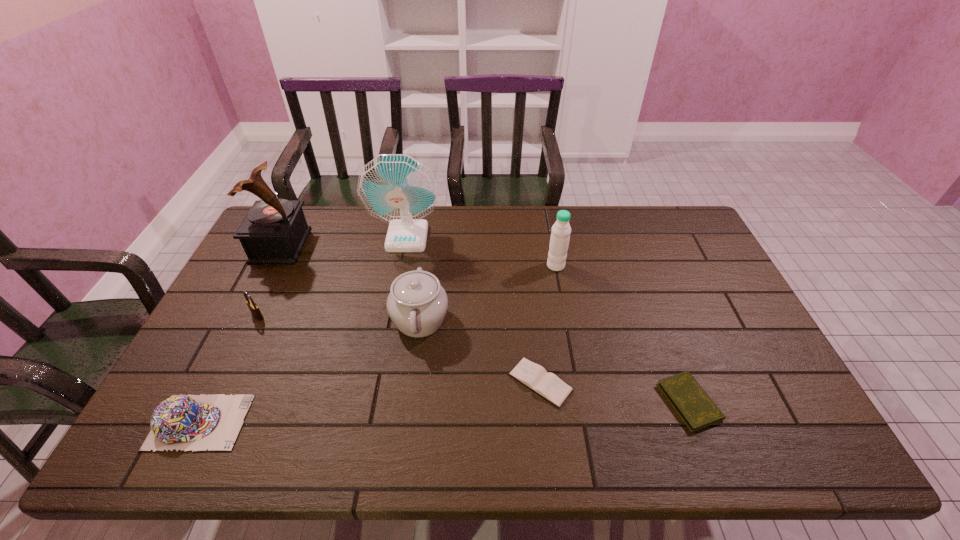
Where is `vacant space that is in between the third tallest object and the sixth tallest object`? vacant space that is in between the third tallest object and the sixth tallest object is located at coordinates (378, 344).

I want to click on empty space between the chinaware and the water bottle, so click(x=488, y=293).

I want to click on blank region between the padlock and the fan, so click(332, 276).

Identify the location of vacant area that lies between the third shortest object and the fourth tallest object. The width and height of the screenshot is (960, 540). (310, 371).

I want to click on free space between the cap and the left diary, so click(371, 402).

The height and width of the screenshot is (540, 960). I want to click on vacant area that lies between the fan and the left diary, so click(474, 309).

You are a GUI agent. You are given a task and a screenshot of the screen. Output one action in this format:
    pyautogui.click(x=<x>, y=<y>)
    Task: Click on the unoccupied position between the cap and the phonograph_record
    Image resolution: width=960 pixels, height=540 pixels.
    Given the screenshot: What is the action you would take?
    pyautogui.click(x=240, y=334)

Find the location of a particular element. This screenshot has width=960, height=540. free space that is in between the sixth tallest object and the sixth shortest object is located at coordinates (378, 344).

Locate an element on the screen. This screenshot has width=960, height=540. free space between the rightmost object and the fourth shortest object is located at coordinates pos(473,359).

Identify which object is the closest to the fan. Please provide its 2D coordinates. Your answer should be formatted as a tuple, i.e. [(x, y)], where the tuple contains the x and y coordinates of a point satisfying the conditions above.

[(417, 304)]